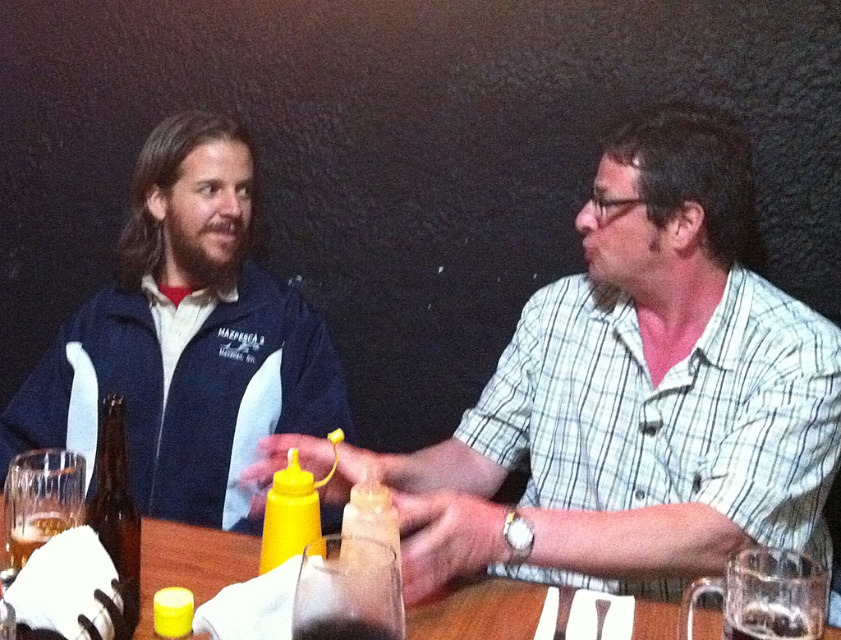
Who is positioned more to the left, brown glass bottle at lower left or yellow matte mustard at center?

brown glass bottle at lower left

Who is more distant from viewer, (119, 433) or (172, 595)?

The point (172, 595) is behind.

The height and width of the screenshot is (640, 841). Find the location of `brown glass bottle at lower left`. brown glass bottle at lower left is located at coordinates (115, 508).

Locate an element on the screen. brown glass bottle at lower left is located at coordinates (115, 508).

Does wooden table at center have a lesser height compared to yellow matte bottle at center?

Correct, wooden table at center is not as tall as yellow matte bottle at center.

Identify the location of wooden table at center. The width and height of the screenshot is (841, 640). (189, 563).

This screenshot has width=841, height=640. I want to click on wooden table at center, so click(189, 563).

Image resolution: width=841 pixels, height=640 pixels. What do you see at coordinates (636, 396) in the screenshot?
I see `matte yellow mustard bottle at center` at bounding box center [636, 396].

Which is more to the right, matte yellow mustard bottle at center or blue fleece jacket at left?

Positioned to the right is matte yellow mustard bottle at center.

In the scene shown: Who is more forward, (453, 509) or (128, 269)?

Point (453, 509)

Where is `matte yellow mustard bottle at center`? matte yellow mustard bottle at center is located at coordinates (636, 396).